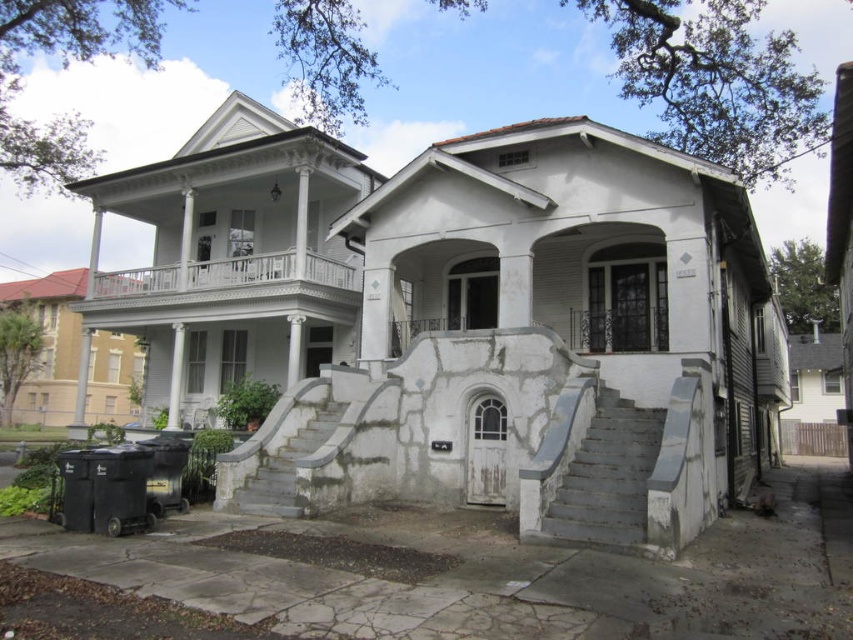
You are standing at the bottom of the gray concrete stairs at center and want to reach the gray concrete stairs at lower right. Which direction should you move to ascend towards them?

The gray concrete stairs at lower right are located above the gray concrete stairs at center, so you should move forward to ascend towards them.

You are a delivery person approaching the gray concrete stairs at lower right and the white painted wood porch at upper center. Which structure should you climb to reach the entrance of the house on the left?

You should climb the white painted wood porch at upper center to reach the entrance of the house on the left because the gray concrete stairs at lower right is in front of it, blocking access.

You are a delivery person carrying a heavy package and need to reach the front door of the house with the white painted wood porch at upper center. The gray concrete stairs at center are in your path. Given that the stairs are 17.72 feet away from the porch, can you safely navigate the stairs while carrying your load?

The distance between the white painted wood porch at upper center and the gray concrete stairs at center is 17.72 feet. Since the stairs are part of the path to the porch, you can safely navigate them while carrying the package as long as you ensure stability over the 17.72 feet distance.